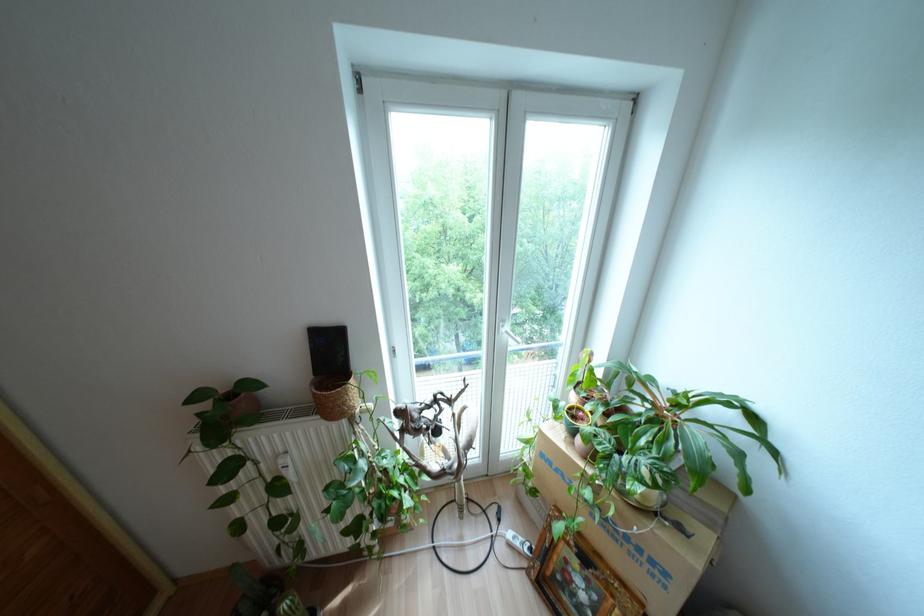
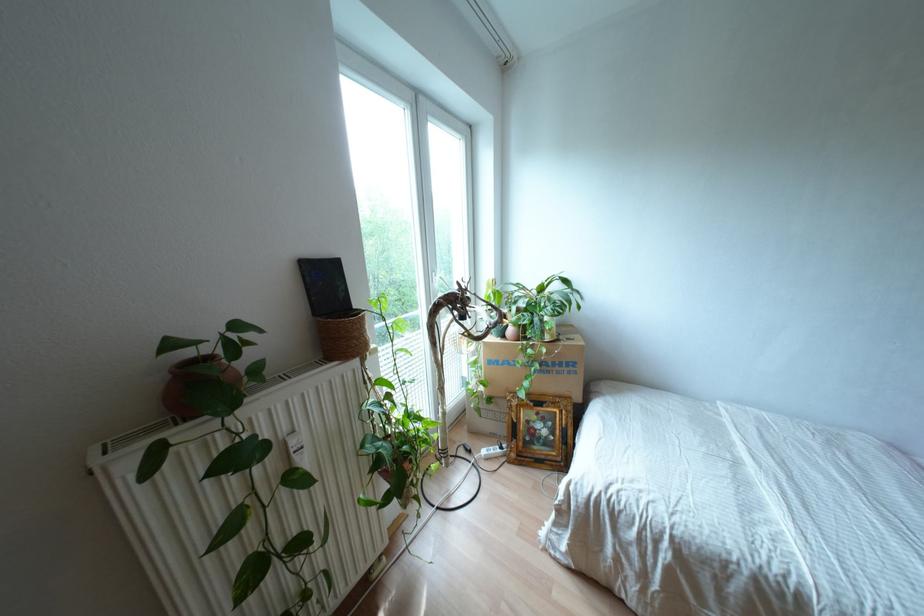
In the second image, find the point that corresponds to (525,549) in the first image.

(497, 450)